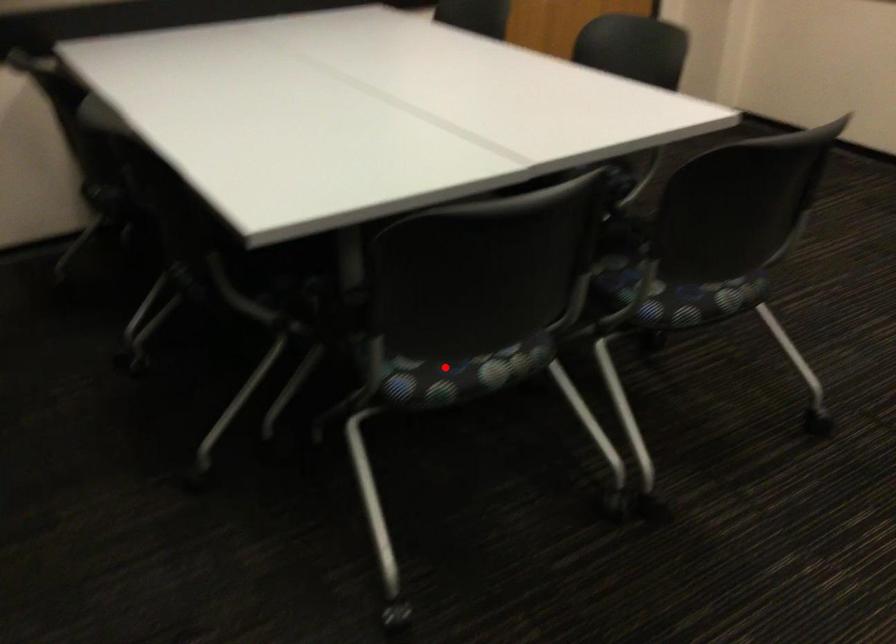
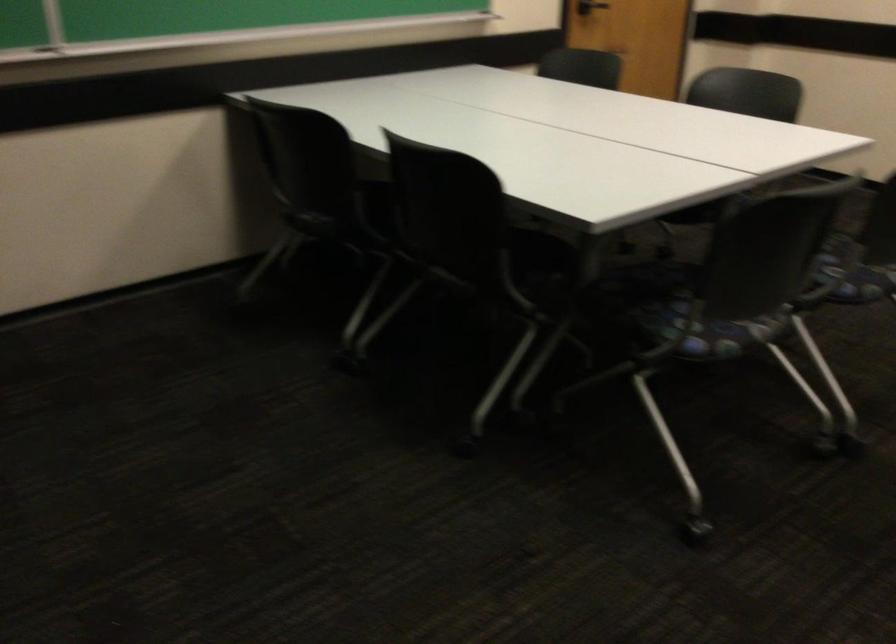
Question: I am providing you with two images of the same scene from different viewpoints. Image1 has a red point marked. In image2, the corresponding 3D location appears at what relative position? Reply with the corresponding letter.

Choices:
 (A) Closer
 (B) Farther

Answer: (B)